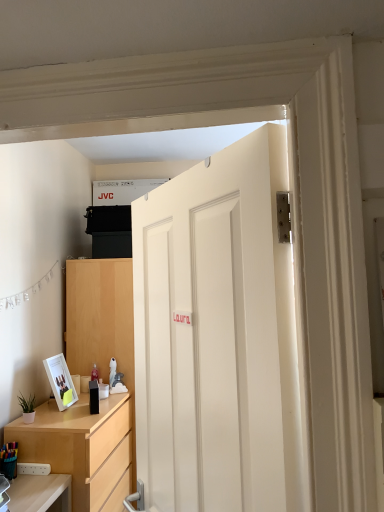
Question: Does white glossy picture frame at lower left come in front of green matte plant at lower left?

Choices:
 (A) no
 (B) yes

Answer: (A)

Question: Is white glossy picture frame at lower left not near green matte plant at lower left?

Choices:
 (A) no
 (B) yes

Answer: (A)

Question: Is the surface of white glossy picture frame at lower left in direct contact with green matte plant at lower left?

Choices:
 (A) no
 (B) yes

Answer: (A)

Question: Is white glossy picture frame at lower left bigger than green matte plant at lower left?

Choices:
 (A) yes
 (B) no

Answer: (A)

Question: From a real-world perspective, is white glossy picture frame at lower left below green matte plant at lower left?

Choices:
 (A) yes
 (B) no

Answer: (B)

Question: Is white glossy picture frame at lower left shorter than green matte plant at lower left?

Choices:
 (A) yes
 (B) no

Answer: (B)

Question: Is the position of green matte plant at lower left more distant than that of white glossy picture frame at lower left?

Choices:
 (A) no
 (B) yes

Answer: (A)

Question: From a real-world perspective, is green matte plant at lower left physically above white glossy picture frame at lower left?

Choices:
 (A) yes
 (B) no

Answer: (B)

Question: Is green matte plant at lower left bigger than white glossy picture frame at lower left?

Choices:
 (A) yes
 (B) no

Answer: (B)

Question: Is green matte plant at lower left smaller than white glossy picture frame at lower left?

Choices:
 (A) yes
 (B) no

Answer: (A)

Question: From the image's perspective, would you say green matte plant at lower left is positioned over white glossy picture frame at lower left?

Choices:
 (A) yes
 (B) no

Answer: (B)

Question: Considering the relative sizes of green matte plant at lower left and white glossy picture frame at lower left in the image provided, is green matte plant at lower left wider than white glossy picture frame at lower left?

Choices:
 (A) no
 (B) yes

Answer: (A)

Question: Is multicolored plastic pen holder at lower left completely or partially inside light wood/texture dresser at lower left?

Choices:
 (A) yes
 (B) no

Answer: (B)